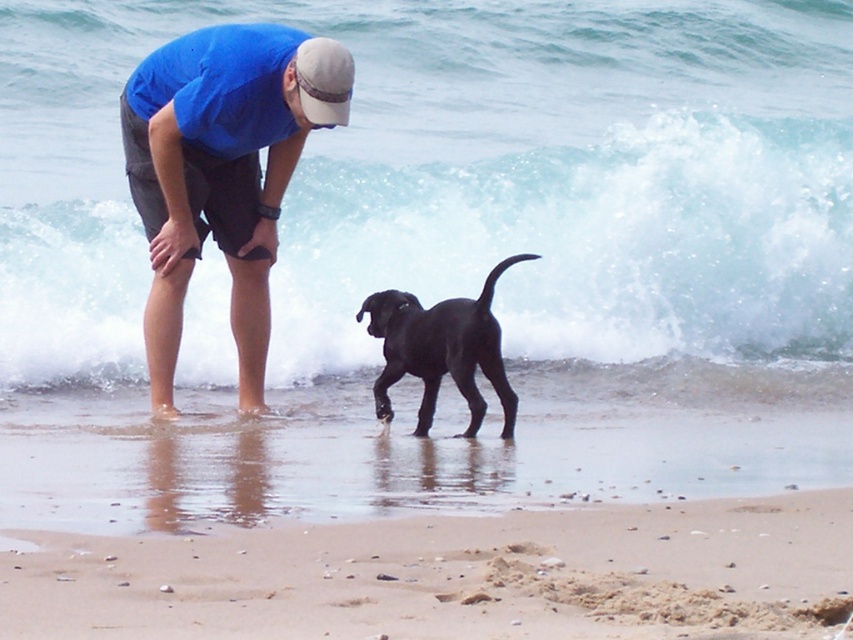
You are standing at the shoreline and want to walk to both the man and the black puppy. The man is at point (682,573) and the puppy is at point (236,205). Which point should you reach first if you want to get to the closer one first?

Point (682,573) is closer to the camera than point (236,205), so you should reach the man at point (682,573) first.

You are a photographer trying to capture a closeup shot of the black matte dog at center and the white fabric baseball cap at upper center. Which object should you zoom in on more to ensure both are in focus?

The black matte dog at center is bigger than the white fabric baseball cap at upper center, so you should zoom in more on the white fabric baseball cap at upper center to ensure both are in focus.